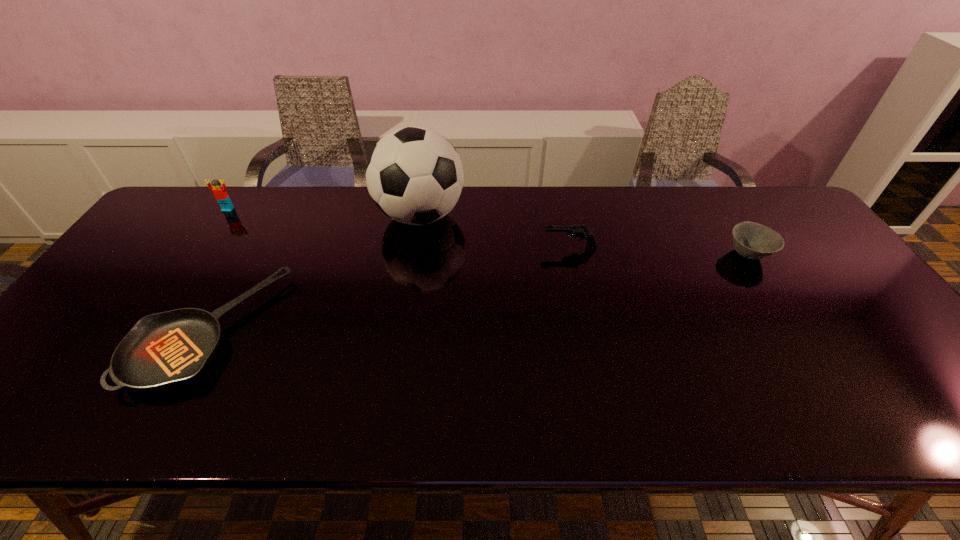
The image size is (960, 540). I want to click on blank region between the shortest object and the third tallest object, so click(389, 289).

Find the location of a particular element. This screenshot has width=960, height=540. empty location between the fourth shortest object and the gun is located at coordinates (398, 228).

In order to click on free spot between the second object from right to left and the rightmost object in this screenshot , I will do `click(659, 251)`.

The image size is (960, 540). What are the coordinates of `vacant space that is in between the bowl and the Lego` in the screenshot? It's located at (488, 232).

Identify which object is the second closest to the gun. Please provide its 2D coordinates. Your answer should be formatted as a tuple, i.e. [(x, y)], where the tuple contains the x and y coordinates of a point satisfying the conditions above.

[(754, 241)]

This screenshot has width=960, height=540. I want to click on object that is the fourth closest to the shortest object, so click(x=754, y=241).

You are a GUI agent. You are given a task and a screenshot of the screen. Output one action in this format:
    pyautogui.click(x=<x>, y=<y>)
    Task: Click on the free location that satisfies the following two spatial constraints: 1. at the end of the barrel of the second object from right to left; 2. on the right side of the rightmost object
    
    Given the screenshot: What is the action you would take?
    pyautogui.click(x=571, y=254)

Locate an element on the screen. This screenshot has height=540, width=960. free location that satisfies the following two spatial constraints: 1. on the face of the fourth tallest object; 2. on the left side of the fourth shortest object is located at coordinates (198, 254).

I want to click on vacant region that satisfies the following two spatial constraints: 1. on the face of the Lego; 2. on the left side of the bowl, so click(x=198, y=254).

Find the location of `free space that satisfies the following two spatial constraints: 1. at the end of the barrel of the third tallest object; 2. on the right side of the rightmost object`. free space that satisfies the following two spatial constraints: 1. at the end of the barrel of the third tallest object; 2. on the right side of the rightmost object is located at coordinates (571, 254).